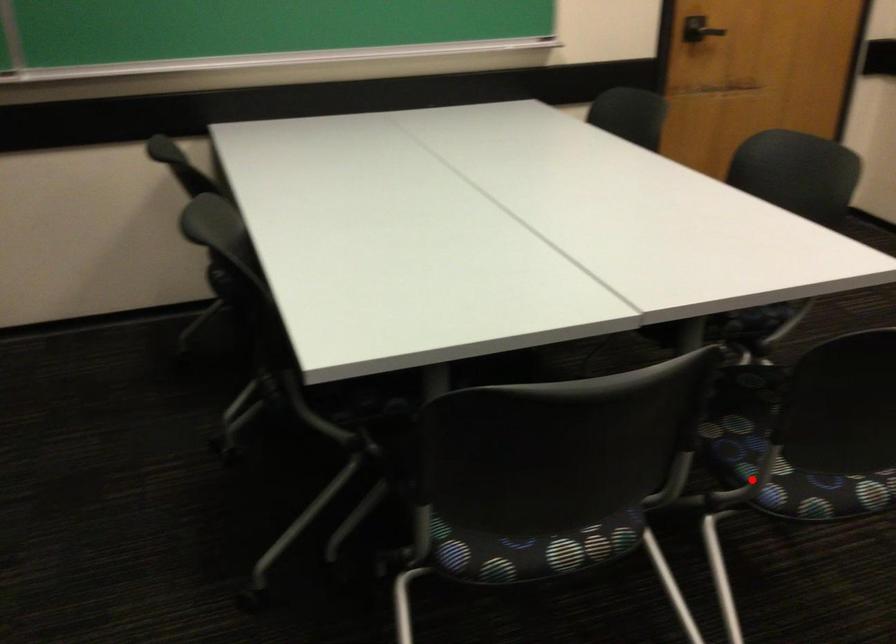
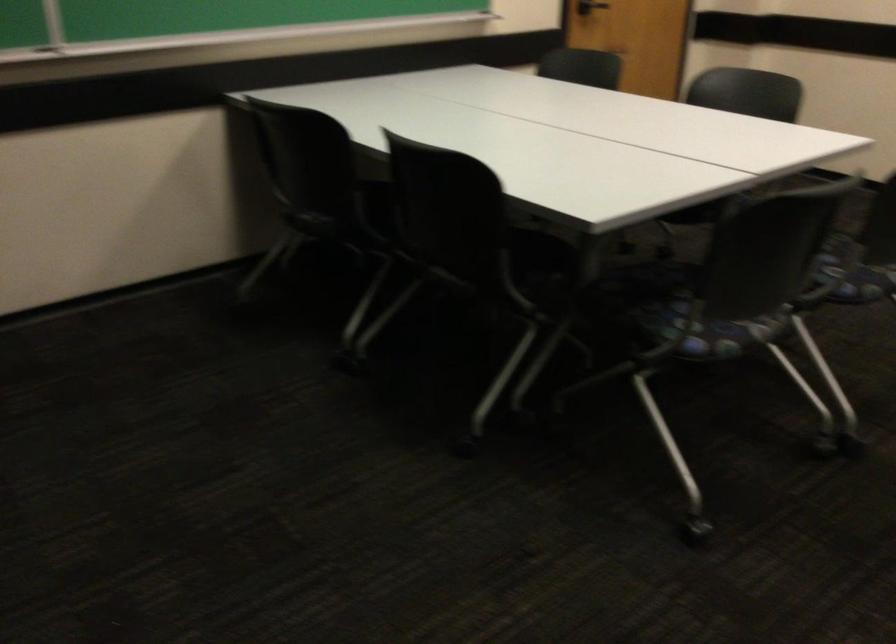
Locate, in the second image, the point that corresponds to the highlighted location in the first image.

(853, 272)